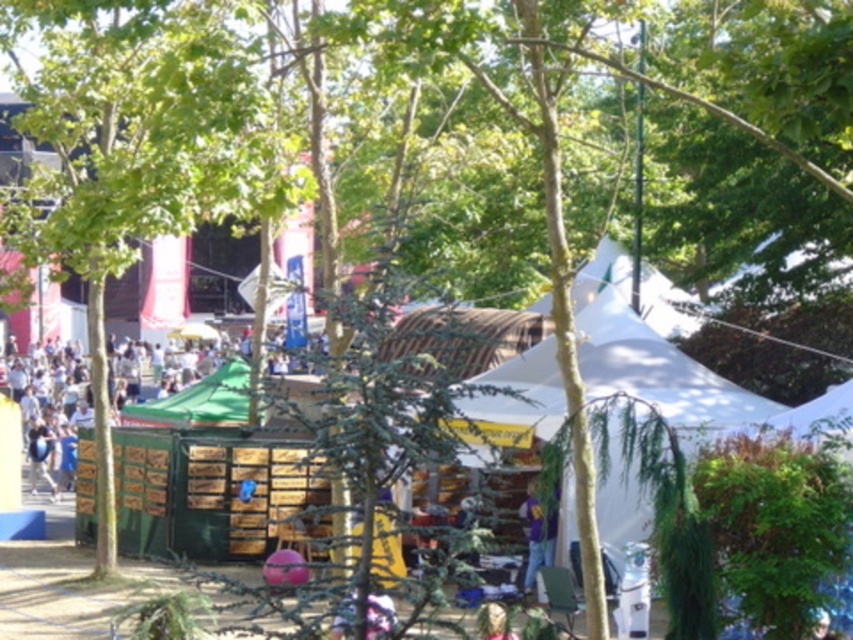
Question: Does green leafy tree at left come in front of purple matte shirt at lower center?

Choices:
 (A) yes
 (B) no

Answer: (A)

Question: Can you confirm if green leafy tree at left is smaller than purple matte shirt at lower center?

Choices:
 (A) yes
 (B) no

Answer: (B)

Question: Which of the following is the farthest from the observer?

Choices:
 (A) purple matte shirt at lower center
 (B) green leafy tree at left

Answer: (A)

Question: Is green leafy tree at left thinner than purple matte shirt at lower center?

Choices:
 (A) yes
 (B) no

Answer: (B)

Question: Which object is farther from the camera taking this photo?

Choices:
 (A) green leafy tree at left
 (B) purple matte shirt at lower center

Answer: (B)